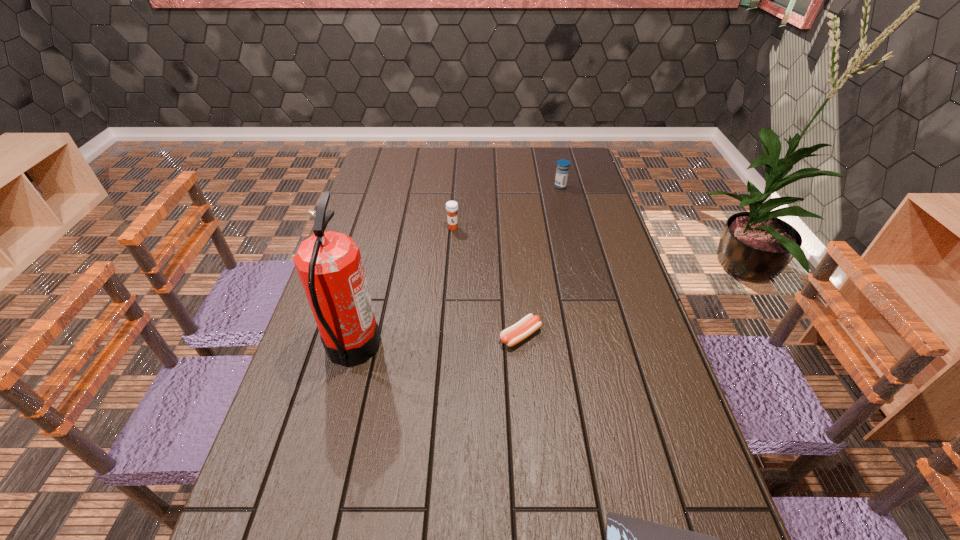
Find the location of a particular element. The height and width of the screenshot is (540, 960). vacant area that lies between the third object from left to right and the leftmost object is located at coordinates tap(437, 342).

At what (x,y) coordinates should I click in order to perform the action: click on free space between the right medicine and the sausage. Please return your answer as a coordinate pair (x, y). The width and height of the screenshot is (960, 540). Looking at the image, I should click on (540, 261).

This screenshot has height=540, width=960. Identify the location of vacant point located between the tallest object and the right medicine. (456, 268).

Locate an element on the screen. The height and width of the screenshot is (540, 960). free spot between the nearer medicine and the fire extinguisher is located at coordinates (402, 288).

In order to click on vacant space that's between the nearer medicine and the farthest object in this screenshot , I will do `click(507, 207)`.

Identify the location of object that ranks as the closest to the nearest object. The height and width of the screenshot is (540, 960). (x=528, y=325).

What are the coordinates of `the fourth closest object relative to the nearest object` in the screenshot? It's located at (562, 171).

The width and height of the screenshot is (960, 540). In order to click on free spot that satisfies the following two spatial constraints: 1. on the label side of the second farthest object; 2. on the front side of the fire extinguisher in this screenshot , I will do `click(444, 349)`.

Locate an element on the screen. This screenshot has height=540, width=960. free region that satisfies the following two spatial constraints: 1. on the label side of the second farthest object; 2. on the right side of the second shortest object is located at coordinates (444, 336).

Where is `vacant space that satisfies the following two spatial constraints: 1. on the label side of the second farthest object; 2. on the front side of the tallest object`? vacant space that satisfies the following two spatial constraints: 1. on the label side of the second farthest object; 2. on the front side of the tallest object is located at coordinates (444, 349).